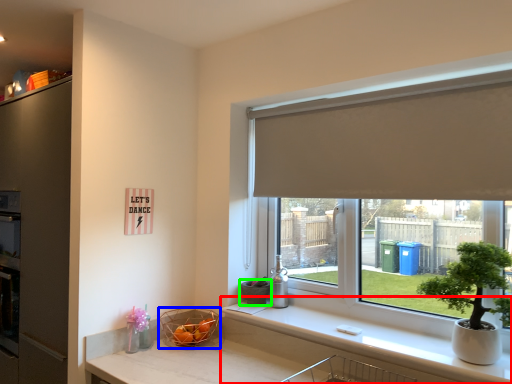
Question: Which is nearer to the counter top (highlighted by a red box)? basket (highlighted by a blue box) or flowerpot (highlighted by a green box).

Choices:
 (A) basket
 (B) flowerpot

Answer: (B)